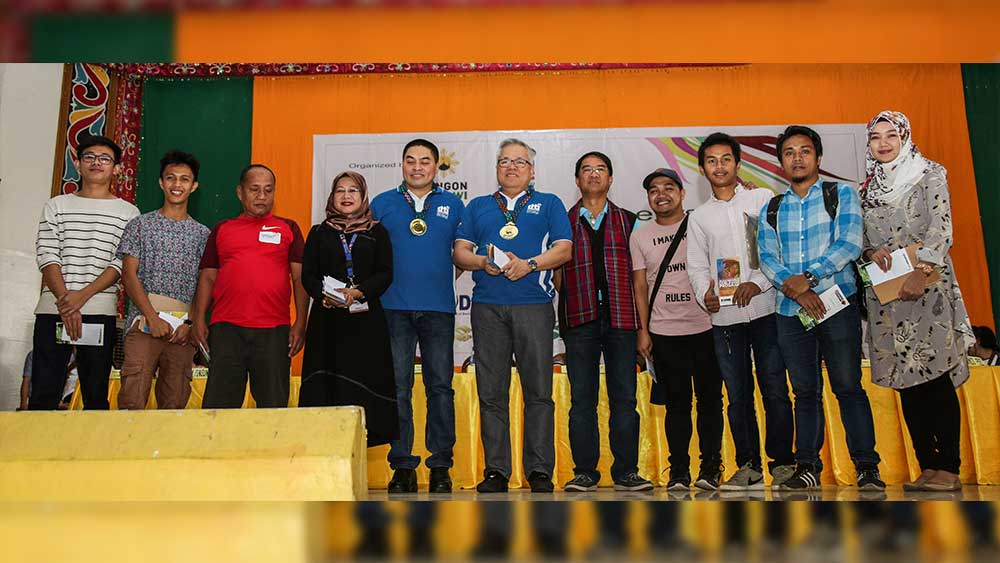
Where is `green wall`? The image size is (1000, 563). green wall is located at coordinates (195, 129), (974, 93).